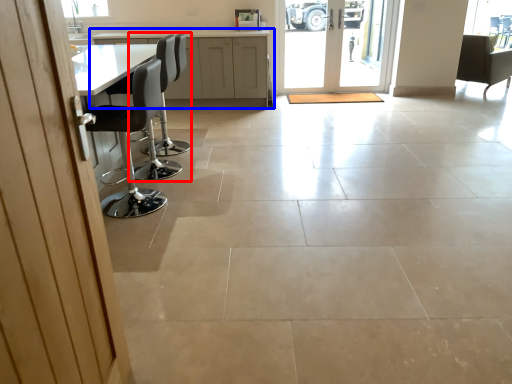
Question: Which of the following is the closest to the observer, chair (highlighted by a red box) or cabinetry (highlighted by a blue box)?

Choices:
 (A) chair
 (B) cabinetry

Answer: (A)